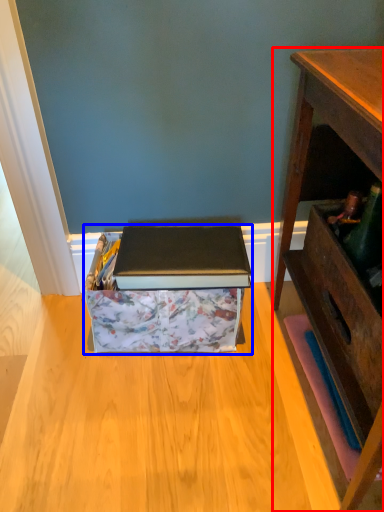
Question: Which of the following is the closest to the observer, desk (highlighted by a red box) or cardboard box (highlighted by a blue box)?

Choices:
 (A) desk
 (B) cardboard box

Answer: (A)